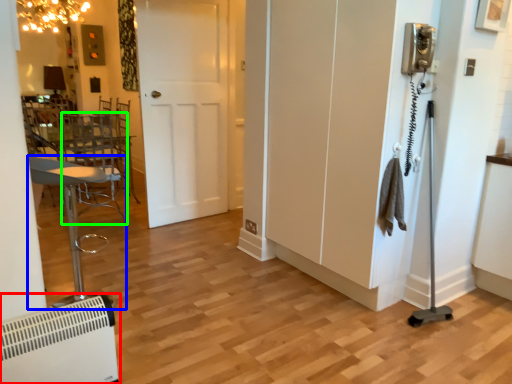
Question: Which is nearer to the air conditioning (highlighted by a red box)? furniture (highlighted by a blue box) or swivel chair (highlighted by a green box).

Choices:
 (A) furniture
 (B) swivel chair

Answer: (A)